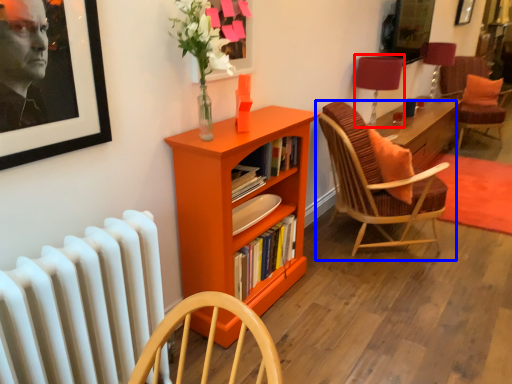
Question: Which object appears closest to the camera in this image, table lamp (highlighted by a red box) or chair (highlighted by a blue box)?

Choices:
 (A) table lamp
 (B) chair

Answer: (B)